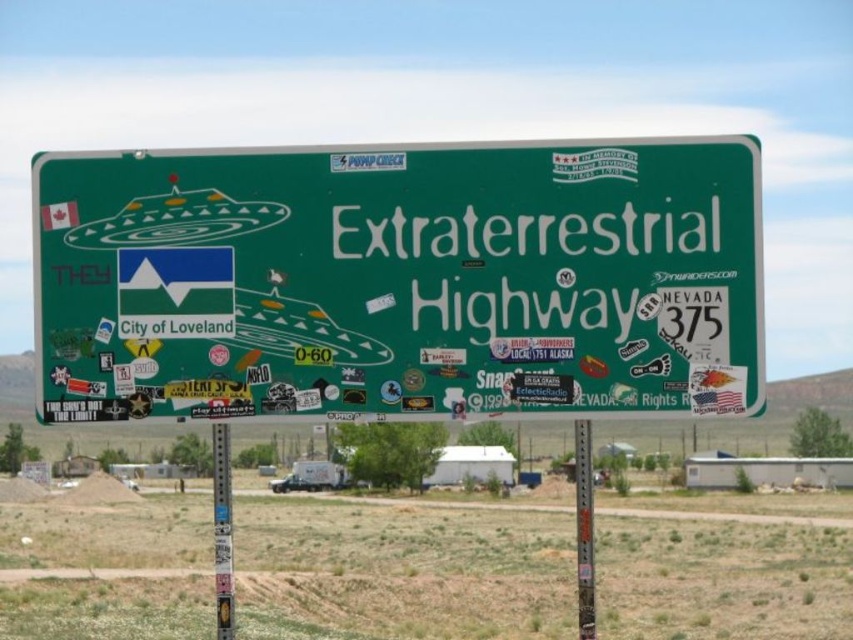
Between green matte highway sign at center and green painted metal pole at center, which one is positioned higher?

green matte highway sign at center is above.

At what (x,y) coordinates should I click in order to perform the action: click on green matte highway sign at center. Please return your answer as a coordinate pair (x, y). The height and width of the screenshot is (640, 853). Looking at the image, I should click on (399, 280).

Which of these two, green matte highway sign at center or metallic pole at lower center, stands shorter?

green matte highway sign at center

Does green matte highway sign at center appear on the left side of metallic pole at lower center?

No, green matte highway sign at center is not to the left of metallic pole at lower center.

Who is more distant from viewer, (x=695, y=147) or (x=219, y=499)?

Positioned behind is point (x=219, y=499).

Find the location of a particular element. green matte highway sign at center is located at coordinates (399, 280).

Between metallic pole at lower center and green painted metal pole at center, which one is positioned lower?

green painted metal pole at center is lower down.

Does metallic pole at lower center have a lesser height compared to green painted metal pole at center?

Indeed, metallic pole at lower center has a lesser height compared to green painted metal pole at center.

Locate an element on the screen. Image resolution: width=853 pixels, height=640 pixels. metallic pole at lower center is located at coordinates (222, 531).

You are a GUI agent. You are given a task and a screenshot of the screen. Output one action in this format:
    pyautogui.click(x=<x>, y=<y>)
    Task: Click on the metallic pole at lower center
    
    Given the screenshot: What is the action you would take?
    pyautogui.click(x=222, y=531)